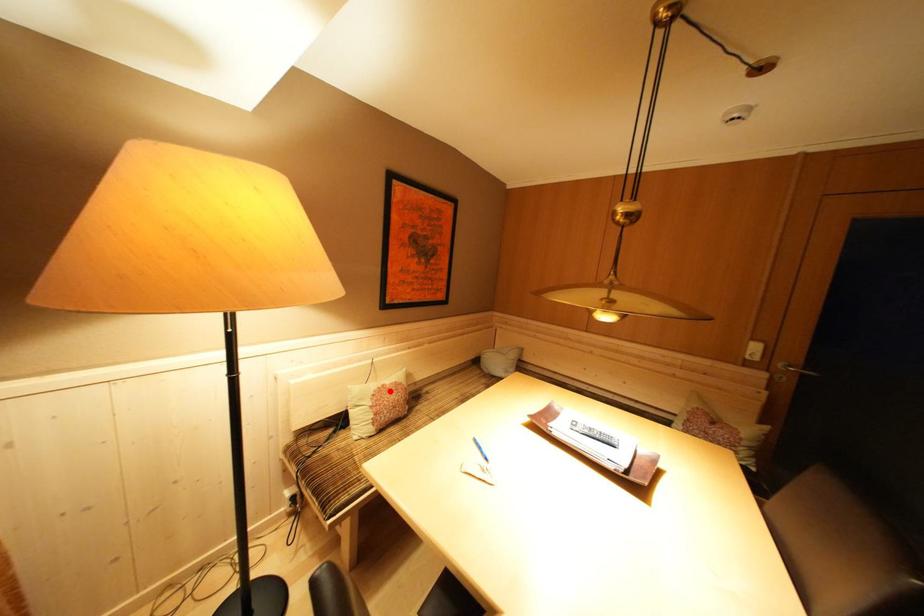
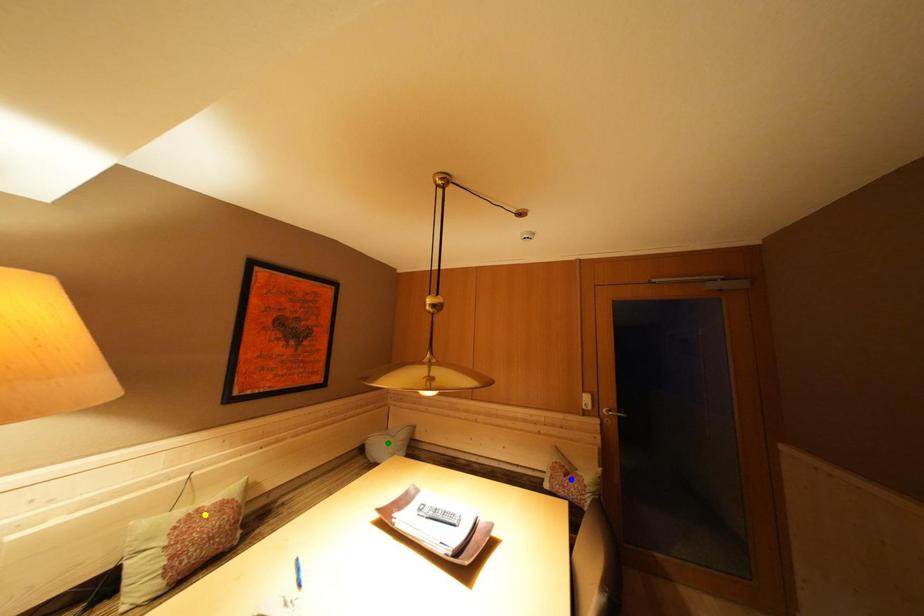
Question: I am providing you with two images of the same scene from different viewpoints. A red point is marked on the first image. You are given multiple points on the second image. In image 2, which mark is for the same physical point as the one in image 1?

Choices:
 (A) green point
 (B) blue point
 (C) yellow point

Answer: (C)